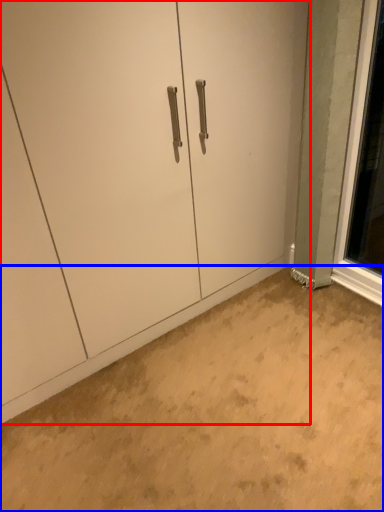
Question: Which of the following is the farthest to the observer, door (highlighted by a red box) or concrete (highlighted by a blue box)?

Choices:
 (A) door
 (B) concrete

Answer: (A)